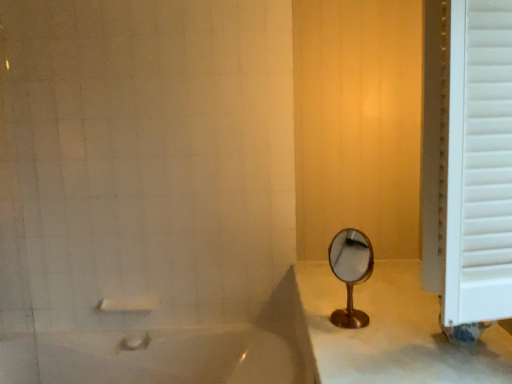
Question: Is gold metallic mirror at center touching white glossy bathtub at lower left?

Choices:
 (A) no
 (B) yes

Answer: (A)

Question: Can white glossy bathtub at lower left be found inside gold metallic mirror at center?

Choices:
 (A) no
 (B) yes

Answer: (A)

Question: Is gold metallic mirror at center in front of white glossy bathtub at lower left?

Choices:
 (A) yes
 (B) no

Answer: (A)

Question: Is white glossy bathtub at lower left at the back of gold metallic mirror at center?

Choices:
 (A) yes
 (B) no

Answer: (B)

Question: Does gold metallic mirror at center have a lesser height compared to white glossy bathtub at lower left?

Choices:
 (A) yes
 (B) no

Answer: (A)

Question: From a real-world perspective, is gold metallic mirror at center on white glossy bathtub at lower left?

Choices:
 (A) no
 (B) yes

Answer: (B)

Question: Considering the relative sizes of white wooden window frame at right and gold metallic mirror at center in the image provided, is white wooden window frame at right bigger than gold metallic mirror at center?

Choices:
 (A) no
 (B) yes

Answer: (B)

Question: Considering the relative sizes of white wooden window frame at right and gold metallic mirror at center in the image provided, is white wooden window frame at right taller than gold metallic mirror at center?

Choices:
 (A) no
 (B) yes

Answer: (B)

Question: Is white wooden window frame at right touching gold metallic mirror at center?

Choices:
 (A) no
 (B) yes

Answer: (A)

Question: Could you tell me if white wooden window frame at right is turned towards gold metallic mirror at center?

Choices:
 (A) yes
 (B) no

Answer: (B)

Question: Is white wooden window frame at right to the left of gold metallic mirror at center from the viewer's perspective?

Choices:
 (A) yes
 (B) no

Answer: (B)

Question: Considering the relative sizes of white wooden window frame at right and gold metallic mirror at center in the image provided, is white wooden window frame at right wider than gold metallic mirror at center?

Choices:
 (A) yes
 (B) no

Answer: (A)

Question: Is white glossy bathtub at lower left positioned before white matte towel bar at lower left?

Choices:
 (A) yes
 (B) no

Answer: (A)